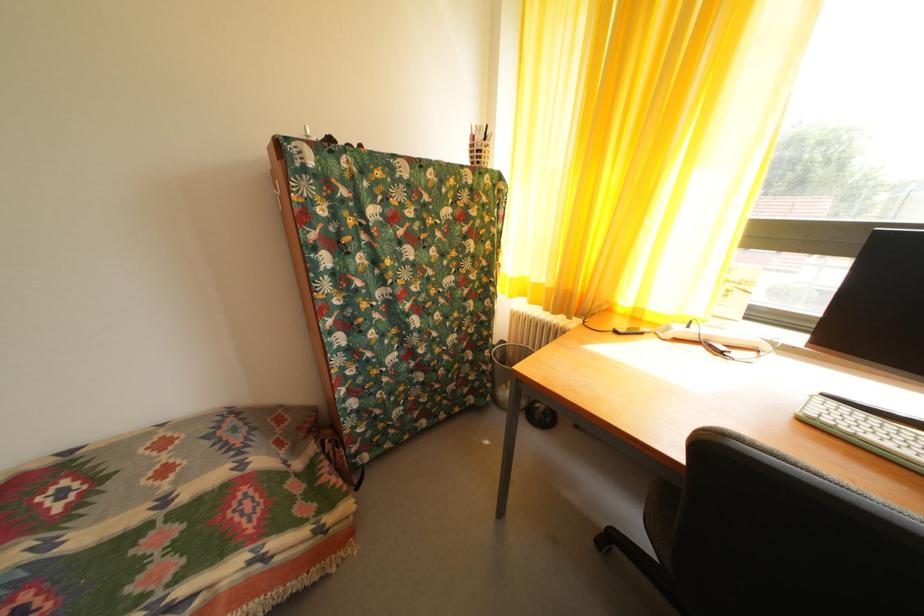
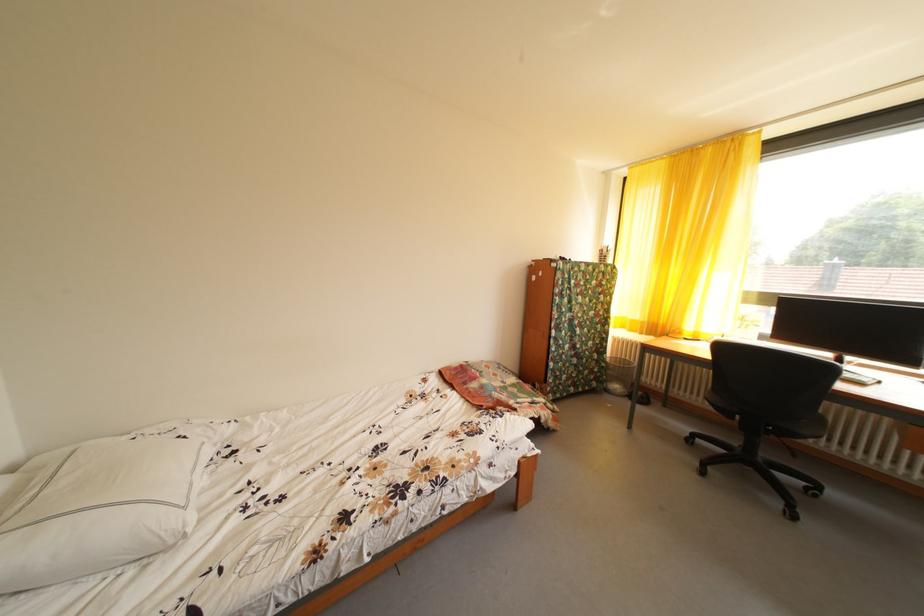
Which direction would the cameraman need to move to produce the second image?

The movement direction of the cameraman is left, backward.